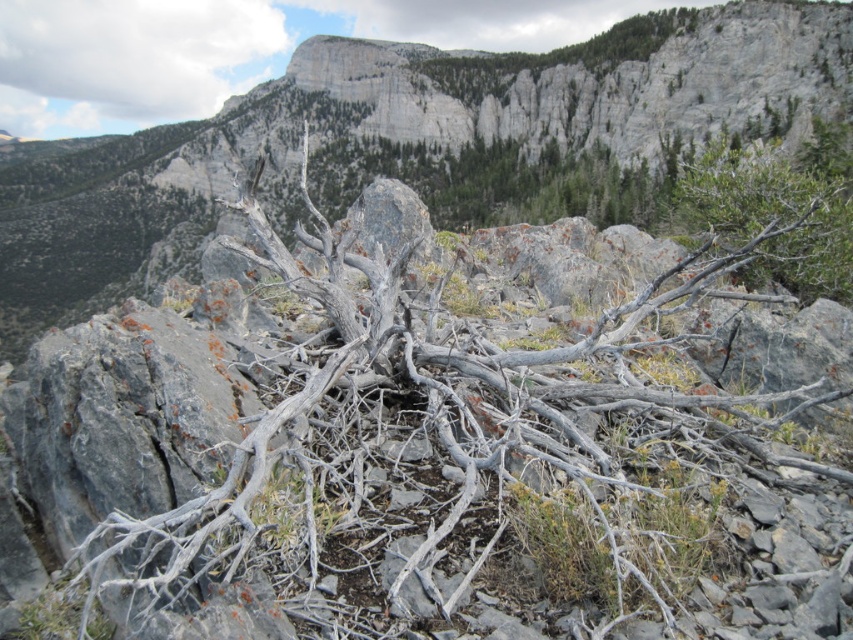
How distant is gray rock at center from green leafy shrub at upper right?

gray rock at center and green leafy shrub at upper right are 106.45 meters apart from each other.

Is gray rock at center to the left of green leafy shrub at upper right from the viewer's perspective?

Correct, you'll find gray rock at center to the left of green leafy shrub at upper right.

Is point (154, 221) positioned before point (764, 276)?

No, (154, 221) is behind (764, 276).

Locate an element on the screen. This screenshot has width=853, height=640. gray rock at center is located at coordinates (419, 144).

Between point (837, 195) and point (485, 61), which one is positioned in front?

Point (837, 195) is more forward.

Can you confirm if green leafy shrub at upper right is positioned to the right of gray rocky cliff at upper center?

Correct, you'll find green leafy shrub at upper right to the right of gray rocky cliff at upper center.

Does point (763, 154) come closer to viewer compared to point (482, 84)?

Yes, point (763, 154) is in front of point (482, 84).

The height and width of the screenshot is (640, 853). Identify the location of green leafy shrub at upper right. (778, 209).

Which is more to the right, gray rock at center or gray rocky cliff at upper center?

From the viewer's perspective, gray rocky cliff at upper center appears more on the right side.

Is gray rock at center above gray rocky cliff at upper center?

Actually, gray rock at center is below gray rocky cliff at upper center.

Measure the distance between point (85, 160) and camera.

A distance of 354.69 meters exists between point (85, 160) and camera.

In order to click on gray rock at center in this screenshot , I will do `click(419, 144)`.